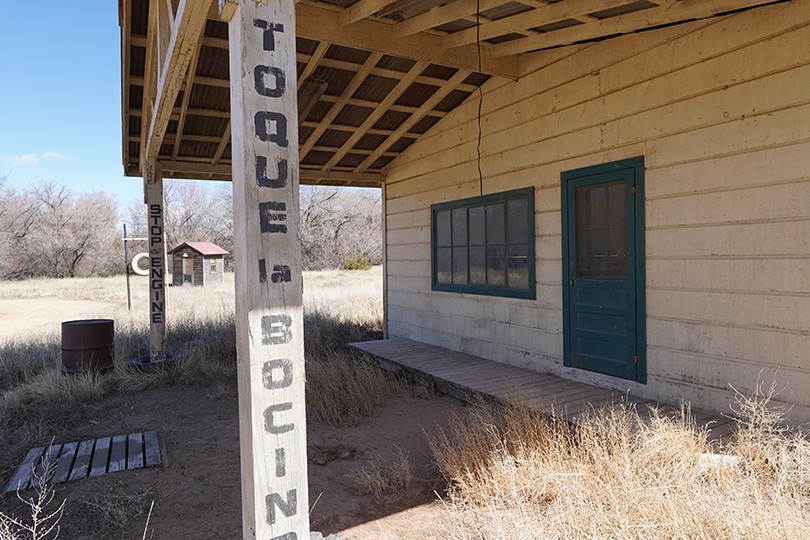
Locate an element on the screen. This screenshot has width=810, height=540. wooden plank cover is located at coordinates (84, 453).